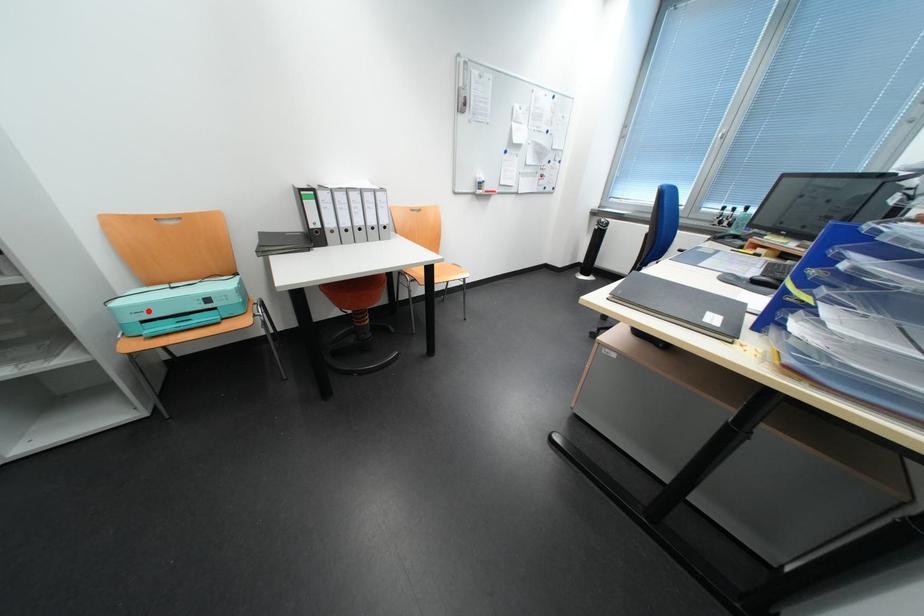
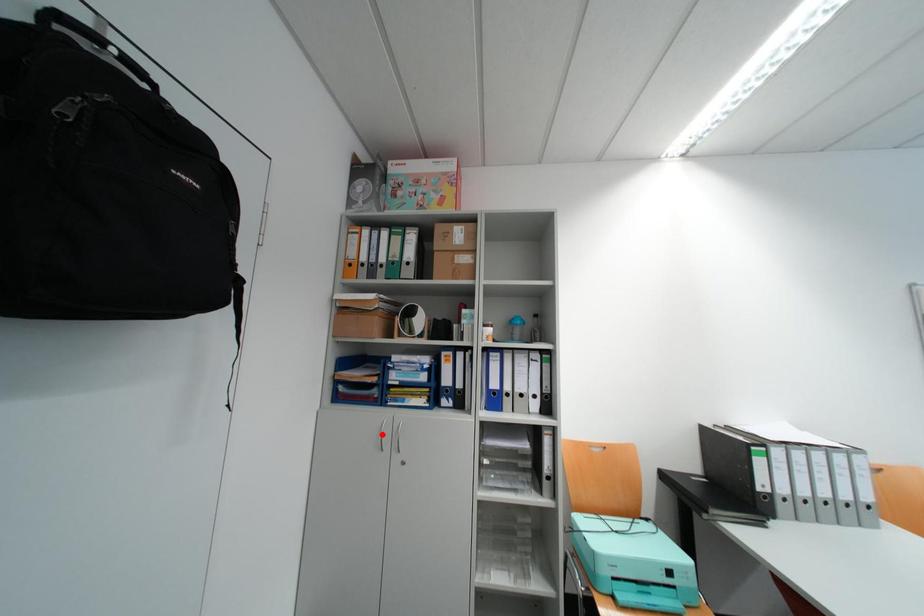
I am providing you with two images of the same scene from different viewpoints. A red point is marked on the first image and another point is marked on the second image. Does the point marked in image1 correspond to the same location as the one in image2?

No